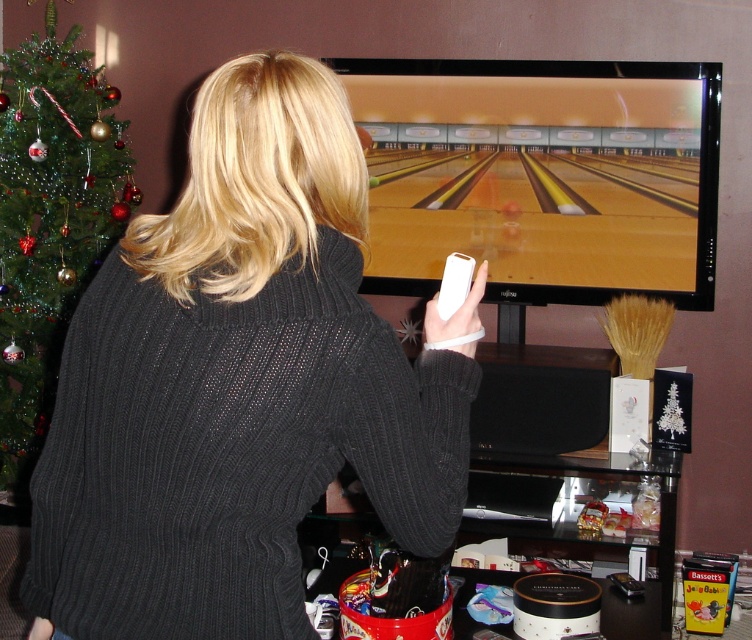
Which of these two, black ribbed sweater at center or green textured christmas tree at left, stands taller?

green textured christmas tree at left is taller.

Which is more to the right, black ribbed sweater at center or green textured christmas tree at left?

black ribbed sweater at center is more to the right.

Where is `black ribbed sweater at center`? This screenshot has width=752, height=640. black ribbed sweater at center is located at coordinates (235, 385).

This screenshot has height=640, width=752. In order to click on black ribbed sweater at center in this screenshot , I will do `click(235, 385)`.